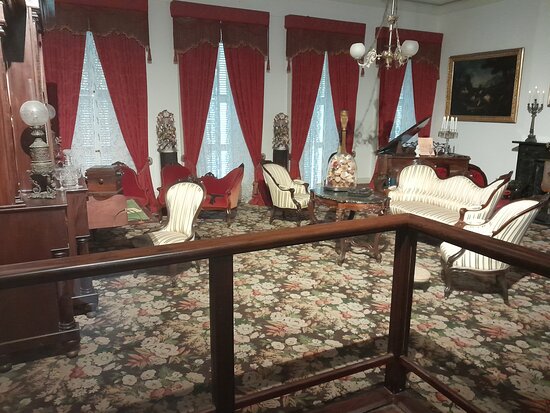
The width and height of the screenshot is (550, 413). I want to click on sofa, so click(x=444, y=194).